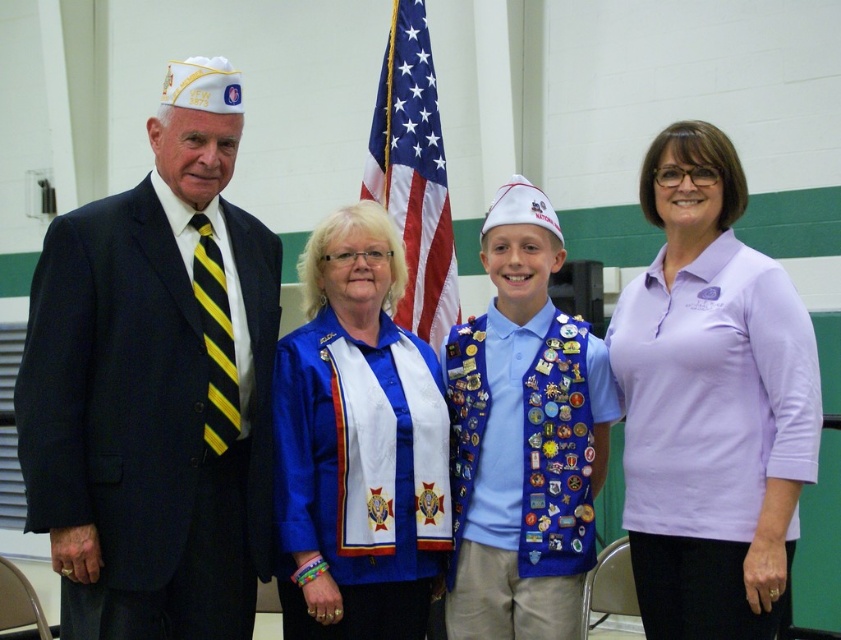
Question: Which point is closer to the camera?

Choices:
 (A) (43, 266)
 (B) (569, 492)
 (C) (373, 156)

Answer: (A)

Question: Based on their relative distances, which object is nearer to the blue satin sash at center?

Choices:
 (A) american flag at center
 (B) lavender cotton polo shirt at center
 (C) blue velvet sash at center

Answer: (C)

Question: Is blue velvet sash at center below american flag at center?

Choices:
 (A) yes
 (B) no

Answer: (A)

Question: Is blue satin sash at center below blue velvet sash at center?

Choices:
 (A) yes
 (B) no

Answer: (A)

Question: Is blue velvet sash at center positioned at the back of american flag at center?

Choices:
 (A) yes
 (B) no

Answer: (B)

Question: Which of these objects is positioned farthest from the blue velvet sash at center?

Choices:
 (A) lavender cotton polo shirt at center
 (B) blue satin sash at center
 (C) matte black suit at left

Answer: (C)